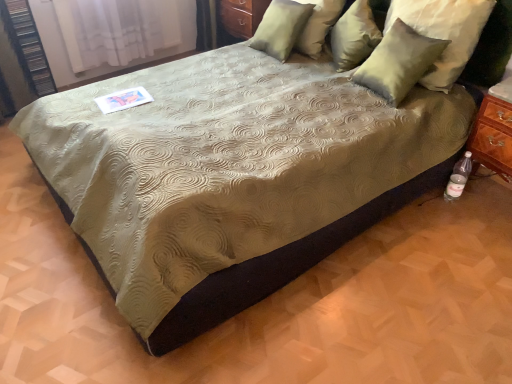
The width and height of the screenshot is (512, 384). Describe the element at coordinates (122, 29) in the screenshot. I see `white sheer curtain at upper left` at that location.

Image resolution: width=512 pixels, height=384 pixels. I want to click on suede-like beige pillow at upper right, acting as the 2th pillow starting from the left, so click(x=354, y=36).

The height and width of the screenshot is (384, 512). What do you see at coordinates (280, 28) in the screenshot?
I see `satin green pillow at upper right, acting as the 4th pillow starting from the right` at bounding box center [280, 28].

In order to face satin green pillow at upper right, marked as the second pillow in a right-to-left arrangement, should I rotate leftwards or rightwards?

Rotate right and turn 19.177 degrees.

In order to face clear plastic bottle at lower right, should I rotate leftwards or rightwards?

To face it directly, rotate right by 25.432 degrees.

I want to click on white sheer curtain at upper left, so click(x=122, y=29).

Is white sheer curtain at upper left further to the viewer compared to clear plastic bottle at lower right?

Yes, the depth of white sheer curtain at upper left is greater than that of clear plastic bottle at lower right.

Is white sheer curtain at upper left bigger or smaller than clear plastic bottle at lower right?

Clearly, white sheer curtain at upper left is larger in size than clear plastic bottle at lower right.

Looking at their sizes, would you say white sheer curtain at upper left is wider or thinner than clear plastic bottle at lower right?

Clearly, white sheer curtain at upper left has less width compared to clear plastic bottle at lower right.

From the image's perspective, between white sheer curtain at upper left and clear plastic bottle at lower right, which one is located above?

white sheer curtain at upper left is shown above in the image.

Could you tell me if satin green pillow at upper right, marked as the second pillow in a right-to-left arrangement, is turned towards white sheer curtain at upper left?

No, satin green pillow at upper right, marked as the second pillow in a right-to-left arrangement, is not oriented towards white sheer curtain at upper left.

From a real-world perspective, which is physically below, satin green pillow at upper right, the third pillow viewed from the left, or white sheer curtain at upper left?

In real-world perspective, white sheer curtain at upper left is lower.

Is point (386, 68) more distant than point (78, 65)?

No, (386, 68) is closer to viewer.

Which of these two, satin green pillow at upper right, acting as the first pillow starting from the left, or matte wood dresser at upper center, is wider?

With larger width is matte wood dresser at upper center.

Do you think satin green pillow at upper right, acting as the 4th pillow starting from the right, is within matte wood dresser at upper center, or outside of it?

satin green pillow at upper right, acting as the 4th pillow starting from the right, exists outside the volume of matte wood dresser at upper center.

Between satin green pillow at upper right, acting as the first pillow starting from the left, and matte wood dresser at upper center, which one has larger size?

matte wood dresser at upper center is bigger.

Are satin green pillow at upper right, acting as the 4th pillow starting from the right, and matte wood dresser at upper center beside each other?

There is a gap between satin green pillow at upper right, acting as the 4th pillow starting from the right, and matte wood dresser at upper center.

Is point (85, 55) behind point (413, 9)?

Yes.

Looking at this image, considering the sizes of white sheer curtain at upper left and satin green pillow at upper right, which is the first pillow in right-to-left order, in the image, is white sheer curtain at upper left taller or shorter than satin green pillow at upper right, which is the first pillow in right-to-left order,?

white sheer curtain at upper left is taller than satin green pillow at upper right, which is the first pillow in right-to-left order.

Find the location of a particular element. Image resolution: width=512 pixels, height=384 pixels. the 4th pillow located above the white sheer curtain at upper left (from a real-world perspective) is located at coordinates click(444, 32).

In the scene shown: Considering the positions of objects white sheer curtain at upper left and satin green pillow at upper right, which is the first pillow in right-to-left order, in the image provided, who is more to the right, white sheer curtain at upper left or satin green pillow at upper right, which is the first pillow in right-to-left order,?

Positioned to the right is satin green pillow at upper right, which is the first pillow in right-to-left order.

Is the position of satin green pillow at upper right, acting as the 4th pillow starting from the right, less distant than that of satin green pillow at upper right, which is the first pillow in right-to-left order?

No, satin green pillow at upper right, acting as the 4th pillow starting from the right, is further to the viewer.

Does satin green pillow at upper right, acting as the first pillow starting from the left, turn towards satin green pillow at upper right, the fourth pillow from the left?

No.

From a real-world perspective, count 3rd pillows upward from the satin green pillow at upper right, acting as the 4th pillow starting from the right, and point to it. Please provide its 2D coordinates.

[(444, 32)]

Can you confirm if satin green pillow at upper right, acting as the first pillow starting from the left, is thinner than suede-like beige pillow at upper right, positioned as the 3th pillow in right-to-left order?

Indeed, satin green pillow at upper right, acting as the first pillow starting from the left, has a lesser width compared to suede-like beige pillow at upper right, positioned as the 3th pillow in right-to-left order.

In the scene shown: Would you say satin green pillow at upper right, acting as the first pillow starting from the left, contains suede-like beige pillow at upper right, positioned as the 3th pillow in right-to-left order?

No.

Is satin green pillow at upper right, acting as the first pillow starting from the left, next to suede-like beige pillow at upper right, positioned as the 3th pillow in right-to-left order, and touching it?

No, satin green pillow at upper right, acting as the first pillow starting from the left, is not touching suede-like beige pillow at upper right, positioned as the 3th pillow in right-to-left order.

How different are the orientations of satin green pillow at upper right, acting as the 4th pillow starting from the right, and suede-like beige pillow at upper right, positioned as the 3th pillow in right-to-left order, in degrees?

36.2 degrees.

Are matte wood dresser at upper center and clear plastic bottle at lower right making contact?

No, matte wood dresser at upper center is not with clear plastic bottle at lower right.

From a real-world perspective, is matte wood dresser at upper center positioned over clear plastic bottle at lower right based on gravity?

Correct, in the physical world, matte wood dresser at upper center is higher than clear plastic bottle at lower right.

Considering the sizes of objects matte wood dresser at upper center and clear plastic bottle at lower right in the image provided, who is wider, matte wood dresser at upper center or clear plastic bottle at lower right?

Wider between the two is matte wood dresser at upper center.

This screenshot has width=512, height=384. Identify the location of bottle below the white sheer curtain at upper left (from a real-world perspective). (459, 177).

There is a white sheer curtain at upper left. Identify the location of the 3rd pillow above it (from a real-world perspective). The height and width of the screenshot is (384, 512). (399, 62).

Looking at the image, which one is located closer to matte wood dresser at upper center, satin green pillow at upper right, which is the first pillow in right-to-left order, or satin green pillow at upper right, marked as the second pillow in a right-to-left arrangement?

Among the two, satin green pillow at upper right, marked as the second pillow in a right-to-left arrangement, is located nearer to matte wood dresser at upper center.

Estimate the real-world distances between objects in this image. Which object is further from satin green pillow at upper right, the third pillow viewed from the left, white sheer curtain at upper left or satin green pillow at upper right, acting as the 4th pillow starting from the right?

white sheer curtain at upper left.

When comparing their distances from white sheer curtain at upper left, does satin green pillow at upper right, acting as the first pillow starting from the left, or suede-like beige pillow at upper right, acting as the 2th pillow starting from the left, seem closer?

Based on the image, satin green pillow at upper right, acting as the first pillow starting from the left, appears to be nearer to white sheer curtain at upper left.

When comparing their distances from white sheer curtain at upper left, does satin green pillow at upper right, marked as the second pillow in a right-to-left arrangement, or matte wood dresser at upper center seem closer?

matte wood dresser at upper center is closer to white sheer curtain at upper left.

From the image, which object appears to be farther from satin green pillow at upper right, which is the first pillow in right-to-left order, white sheer curtain at upper left or clear plastic bottle at lower right?

The object further to satin green pillow at upper right, which is the first pillow in right-to-left order, is white sheer curtain at upper left.

Considering their positions, is white sheer curtain at upper left positioned further to satin green pillow at upper right, the fourth pillow from the left, than satin green pillow at upper right, marked as the second pillow in a right-to-left arrangement?

The object further to satin green pillow at upper right, the fourth pillow from the left, is white sheer curtain at upper left.

When comparing their distances from satin green pillow at upper right, the fourth pillow from the left, does suede-like beige pillow at upper right, positioned as the 3th pillow in right-to-left order, or clear plastic bottle at lower right seem further?

clear plastic bottle at lower right is positioned further to the anchor satin green pillow at upper right, the fourth pillow from the left.

Based on their spatial positions, is satin green pillow at upper right, marked as the second pillow in a right-to-left arrangement, or suede-like beige pillow at upper right, acting as the 2th pillow starting from the left, further from white sheer curtain at upper left?

satin green pillow at upper right, marked as the second pillow in a right-to-left arrangement, is positioned further to the anchor white sheer curtain at upper left.

Find the location of a particular element. dresser between white sheer curtain at upper left and suede-like beige pillow at upper right, positioned as the 3th pillow in right-to-left order, from left to right is located at coordinates (238, 19).

At what (x,y) coordinates should I click in order to perform the action: click on pillow between white sheer curtain at upper left and suede-like beige pillow at upper right, positioned as the 3th pillow in right-to-left order, in the horizontal direction. Please return your answer as a coordinate pair (x, y). Looking at the image, I should click on (280, 28).

Identify the location of pillow positioned between satin green pillow at upper right, the third pillow viewed from the left, and satin green pillow at upper right, acting as the first pillow starting from the left, from near to far. The image size is (512, 384). (354, 36).

Locate an element on the screen. pillow between suede-like beige pillow at upper right, acting as the 2th pillow starting from the left, and matte wood dresser at upper center in the front-back direction is located at coordinates (280, 28).